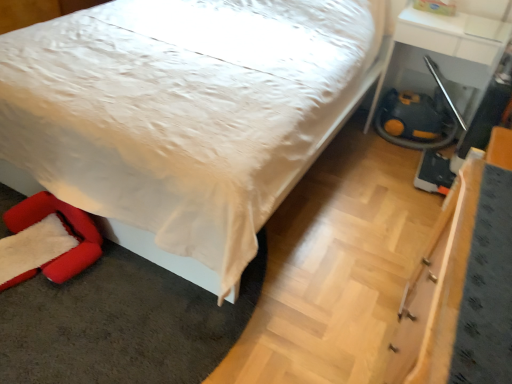
Question: Considering the positions of white glossy table at lower right and white satin bed at center in the image, is white glossy table at lower right wider or thinner than white satin bed at center?

Choices:
 (A) wide
 (B) thin

Answer: (B)

Question: From a real-world perspective, is white glossy table at lower right above or below white satin bed at center?

Choices:
 (A) above
 (B) below

Answer: (B)

Question: Which of these objects is positioned closest to the white glossy table at lower right?

Choices:
 (A) velvet red swivel chair at lower left
 (B) white satin bed at center

Answer: (B)

Question: Estimate the real-world distances between objects in this image. Which object is closer to the white satin bed at center?

Choices:
 (A) velvet red swivel chair at lower left
 (B) white glossy table at lower right

Answer: (A)